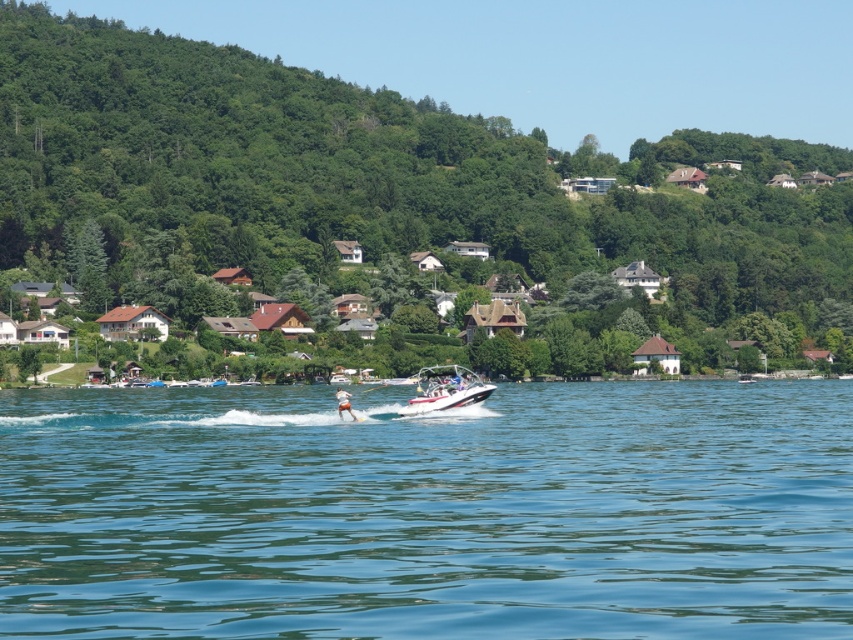
Question: Is clear blue water at center to the left of green leafy tree at center from the viewer's perspective?

Choices:
 (A) no
 (B) yes

Answer: (A)

Question: Which object appears closest to the camera in this image?

Choices:
 (A) white smooth water skier at center
 (B) white glossy speedboat at center
 (C) green leafy tree at center

Answer: (A)

Question: Among these objects, which one is farthest from the camera?

Choices:
 (A) green leafy tree at center
 (B) white smooth water skier at center

Answer: (A)

Question: Is the position of white glossy speedboat at center less distant than that of white smooth water skier at center?

Choices:
 (A) no
 (B) yes

Answer: (A)

Question: Which of the following is the farthest from the observer?

Choices:
 (A) clear blue water at center
 (B) green leafy tree at center
 (C) white glossy speedboat at center

Answer: (B)

Question: Is clear blue water at center thinner than white glossy speedboat at center?

Choices:
 (A) no
 (B) yes

Answer: (A)